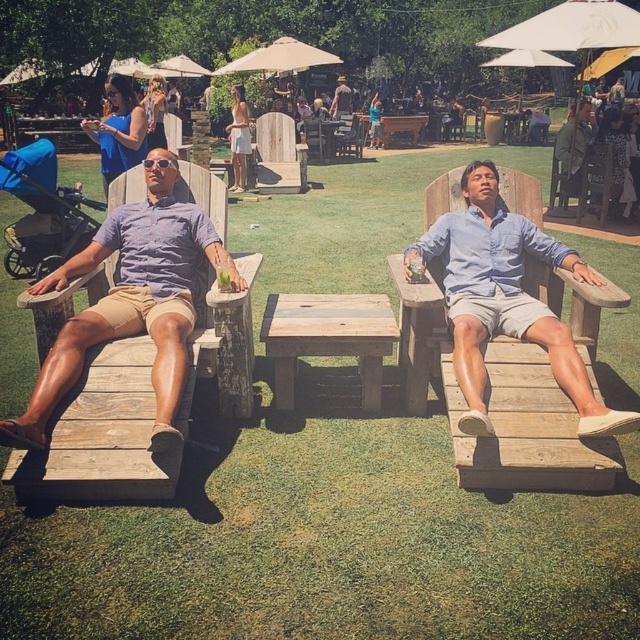
Looking at this image, is matte blue dress at upper left behind wooden chair at right?

No.

Which is in front, point (138, 118) or point (612, 170)?

Positioned in front is point (138, 118).

Is point (129, 134) positioned after point (572, 134)?

No, it is not.

You are a GUI agent. You are given a task and a screenshot of the screen. Output one action in this format:
    pyautogui.click(x=<x>, y=<y>)
    Task: Click on the matte blue dress at upper left
    
    Given the screenshot: What is the action you would take?
    pyautogui.click(x=118, y=129)

Consider the image. Is matte purple shirt at left to the right of matte gray shirt at center from the viewer's perspective?

No, matte purple shirt at left is not to the right of matte gray shirt at center.

In the scene shown: Is matte purple shirt at left taller than matte gray shirt at center?

No.

Is point (104, 253) positioned behind point (337, 99)?

No, it is not.

Locate an element on the screen. This screenshot has width=640, height=640. matte purple shirt at left is located at coordinates (132, 301).

Is matte blue dress at upper left closer to camera compared to wooden chair at center?

Yes, it is in front of wooden chair at center.

From the picture: Can you confirm if matte blue dress at upper left is wider than wooden chair at center?

Correct, the width of matte blue dress at upper left exceeds that of wooden chair at center.

At what (x,y) coordinates should I click in order to perform the action: click on matte blue dress at upper left. Please return your answer as a coordinate pair (x, y). The image size is (640, 640). Looking at the image, I should click on (118, 129).